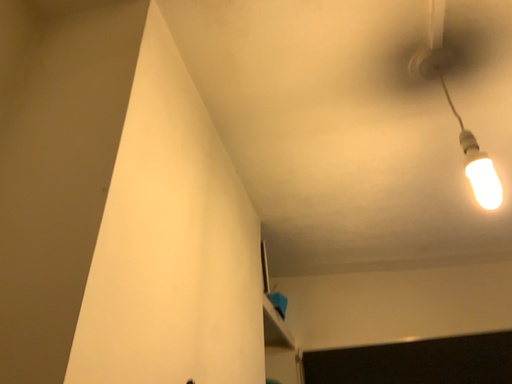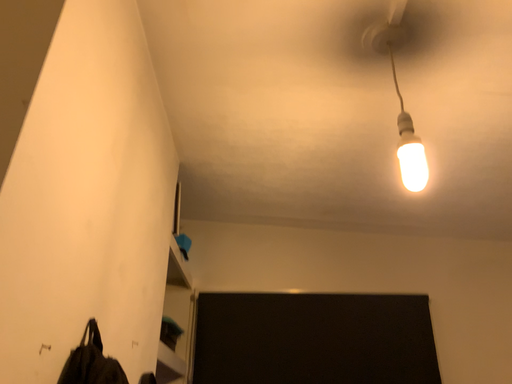
Question: How did the camera likely rotate when shooting the video?

Choices:
 (A) rotated left
 (B) rotated right

Answer: (B)